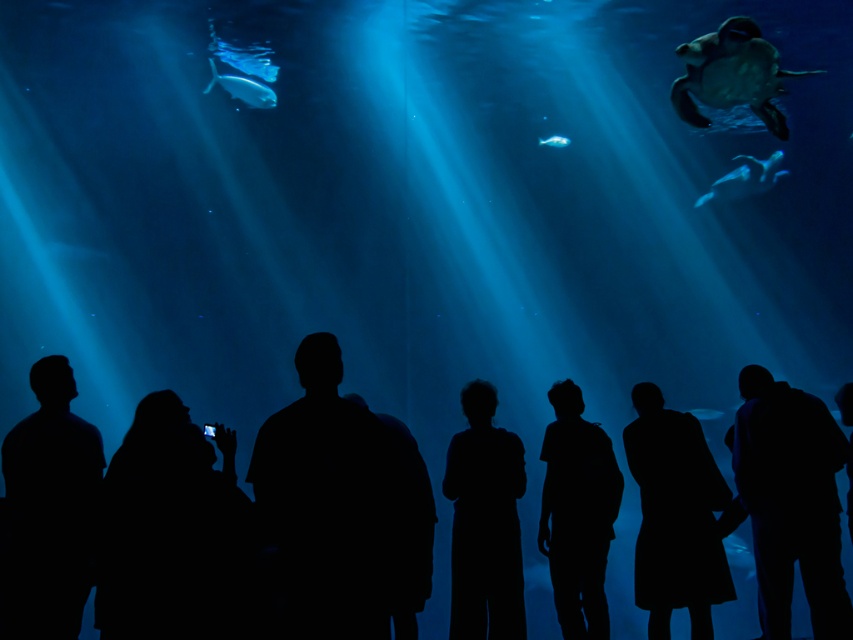
Question: Which of the following is the farthest from the observer?

Choices:
 (A) (756, 180)
 (B) (666, 474)
 (C) (228, 83)
 (D) (80, 563)

Answer: (A)

Question: Based on their relative distances, which object is nearer to the black matte dress at center?

Choices:
 (A) black matte person at left
 (B) black matte person at center
 (C) translucent blue fish at upper center
 (D) black matte jacket at lower right

Answer: (D)

Question: Estimate the real-world distances between objects in this image. Which object is farther from the black matte jacket at lower right?

Choices:
 (A) black matte person at center
 (B) black matte jacket at center
 (C) translucent blue fish at center
 (D) black matte phone at lower left

Answer: (C)

Question: Can you confirm if black matte jacket at lower right is smaller than translucent blue fish at center?

Choices:
 (A) yes
 (B) no

Answer: (B)

Question: Does smooth green turtle at upper right appear under translucent blue fish at center?

Choices:
 (A) yes
 (B) no

Answer: (A)

Question: Is black matte jacket at center thinner than black matte person at left?

Choices:
 (A) no
 (B) yes

Answer: (A)